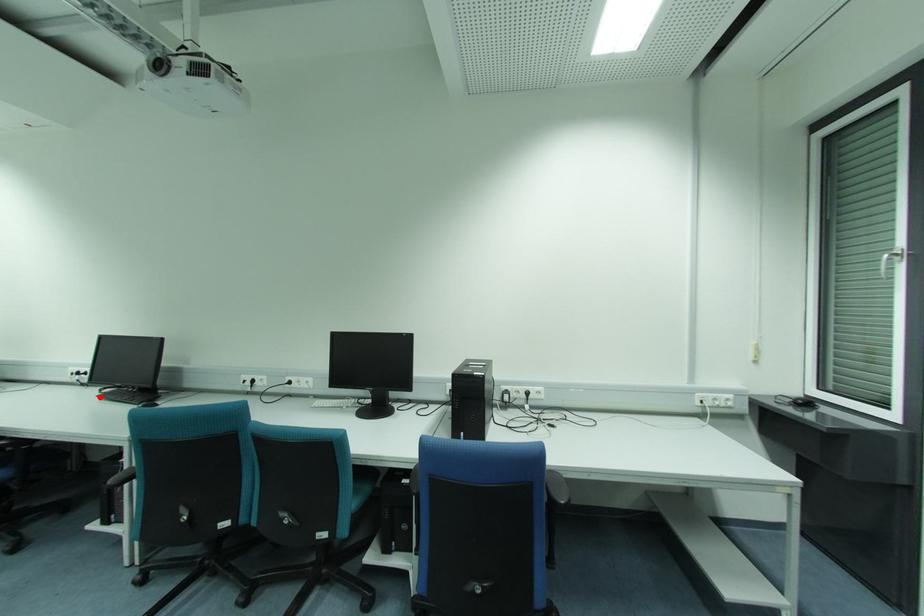
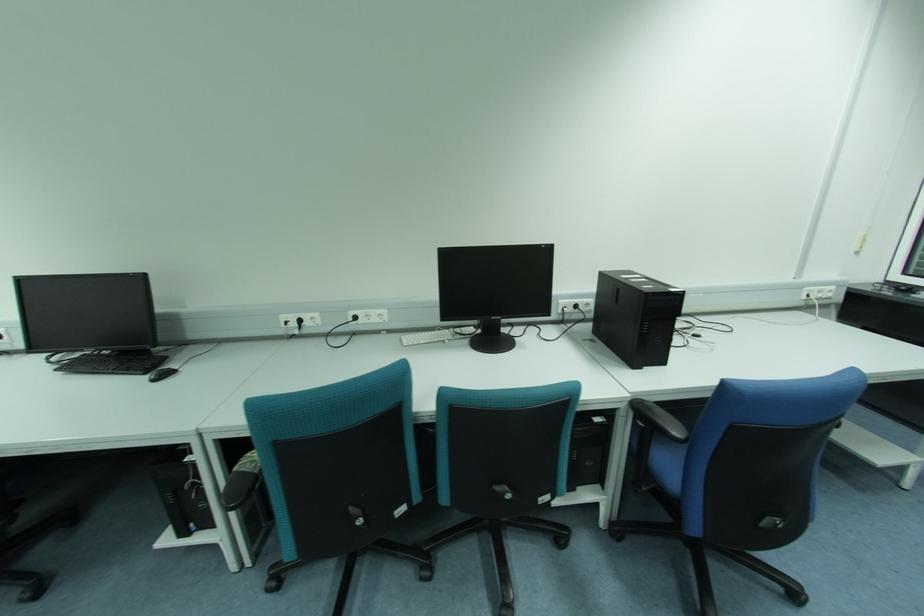
Find the pixel in the second image that matches the highlighted location in the first image.

(58, 370)